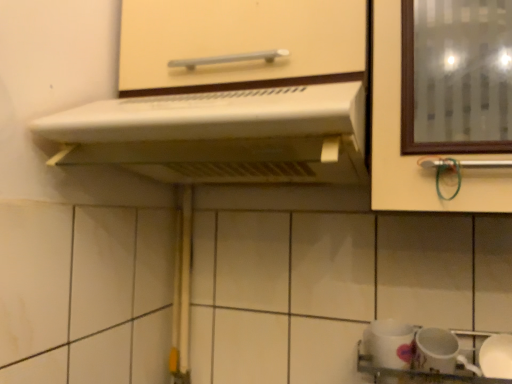
Image resolution: width=512 pixels, height=384 pixels. Describe the element at coordinates (496, 356) in the screenshot. I see `white glossy mug at lower right, the first tableware in the right-to-left sequence` at that location.

Identify the location of matte white cabinet handle at upper center. The image size is (512, 384). (240, 44).

Where is `white glossy mug at lower right, which appears as the second tableware when viewed from the right`? This screenshot has height=384, width=512. white glossy mug at lower right, which appears as the second tableware when viewed from the right is located at coordinates (389, 344).

Where is `white plastic range hood at upper center`? The width and height of the screenshot is (512, 384). white plastic range hood at upper center is located at coordinates (221, 135).

You are a GUI agent. You are given a task and a screenshot of the screen. Output one action in this format:
    pyautogui.click(x=<x>, y=<y>)
    Task: Click on the white glossy mug at lower right, the first tableware in the right-to-left sequence
    The height and width of the screenshot is (384, 512).
    Given the screenshot: What is the action you would take?
    pyautogui.click(x=496, y=356)

Does matte white cabinet handle at upper center come behind white plastic range hood at upper center?

That is True.

Is point (138, 46) less distant than point (110, 129)?

No, it is not.

Which is more to the left, matte white cabinet handle at upper center or white plastic range hood at upper center?

Positioned to the left is white plastic range hood at upper center.

From a real-world perspective, between matte white cabinet handle at upper center and white plastic range hood at upper center, who is vertically higher?

matte white cabinet handle at upper center is physically above.

Between white plastic range hood at upper center and white glossy mug at lower right, which appears as the second tableware when viewed from the right, which one has less height?

Standing shorter between the two is white glossy mug at lower right, which appears as the second tableware when viewed from the right.

How far apart are white plastic range hood at upper center and white glossy mug at lower right, which appears as the second tableware when viewed from the right?

white plastic range hood at upper center is 20.06 inches from white glossy mug at lower right, which appears as the second tableware when viewed from the right.

Between white plastic range hood at upper center and white glossy mug at lower right, placed as the first tableware when sorted from left to right, which one has smaller size?

With smaller size is white glossy mug at lower right, placed as the first tableware when sorted from left to right.

Considering the points (510, 372) and (486, 334), which point is in front, point (510, 372) or point (486, 334)?

The point (510, 372) is closer to the camera.

In terms of width, does white glossy mug at lower right, the first tableware in the right-to-left sequence, look wider or thinner when compared to white glossy sink at lower right?

Considering their sizes, white glossy mug at lower right, the first tableware in the right-to-left sequence, looks slimmer than white glossy sink at lower right.

You are a GUI agent. You are given a task and a screenshot of the screen. Output one action in this format:
    pyautogui.click(x=<x>, y=<y>)
    Task: Click on the sink in front of the white glossy mug at lower right, arranged as the second tableware when viewed from the left
    The image size is (512, 384).
    Given the screenshot: What is the action you would take?
    pyautogui.click(x=418, y=373)

Is the surface of white glossy mug at lower right, the first tableware in the right-to-left sequence, in direct contact with white glossy sink at lower right?

Yes, white glossy mug at lower right, the first tableware in the right-to-left sequence, is touching white glossy sink at lower right.

From a real-world perspective, is matte white cabinet handle at upper center under white glossy sink at lower right?

No, from a real-world perspective, matte white cabinet handle at upper center is not below white glossy sink at lower right.

Can you confirm if matte white cabinet handle at upper center is thinner than white glossy sink at lower right?

Incorrect, the width of matte white cabinet handle at upper center is not less than that of white glossy sink at lower right.

Is point (186, 18) closer or farther from the camera than point (367, 366)?

Point (186, 18) appears to be closer to the viewer than point (367, 366).

Can you confirm if matte white cabinet handle at upper center is smaller than white glossy mug at lower right, placed as the first tableware when sorted from left to right?

Incorrect, matte white cabinet handle at upper center is not smaller in size than white glossy mug at lower right, placed as the first tableware when sorted from left to right.

How different are the orientations of matte white cabinet handle at upper center and white glossy mug at lower right, placed as the first tableware when sorted from left to right, in degrees?

The angle between the facing direction of matte white cabinet handle at upper center and the facing direction of white glossy mug at lower right, placed as the first tableware when sorted from left to right, is 3.58 degrees.

From the image's perspective, does matte white cabinet handle at upper center appear lower than white glossy mug at lower right, placed as the first tableware when sorted from left to right?

No, from the image's perspective, matte white cabinet handle at upper center is not beneath white glossy mug at lower right, placed as the first tableware when sorted from left to right.

Is matte white cabinet handle at upper center outside of white glossy mug at lower right, which appears as the second tableware when viewed from the right?

Yes.

Is white glossy mug at lower right, arranged as the second tableware when viewed from the left, facing away from white plastic range hood at upper center?

white glossy mug at lower right, arranged as the second tableware when viewed from the left, does not have its back to white plastic range hood at upper center.

Consider the image. Is white glossy mug at lower right, arranged as the second tableware when viewed from the left, to the left or to the right of white plastic range hood at upper center in the image?

Based on their positions, white glossy mug at lower right, arranged as the second tableware when viewed from the left, is located to the right of white plastic range hood at upper center.

The width and height of the screenshot is (512, 384). In order to click on tableware that is the 2nd object to the right of the white plastic range hood at upper center, starting at the anchor in this screenshot , I will do `click(496, 356)`.

Considering the relative sizes of white glossy mug at lower right, the first tableware in the right-to-left sequence, and white plastic range hood at upper center in the image provided, is white glossy mug at lower right, the first tableware in the right-to-left sequence, thinner than white plastic range hood at upper center?

Indeed, white glossy mug at lower right, the first tableware in the right-to-left sequence, has a lesser width compared to white plastic range hood at upper center.

Consider the image. Is white plastic range hood at upper center not near white glossy mug at lower right, arranged as the second tableware when viewed from the left?

No, white plastic range hood at upper center is in close proximity to white glossy mug at lower right, arranged as the second tableware when viewed from the left.

How different are the orientations of white plastic range hood at upper center and white glossy mug at lower right, the first tableware in the right-to-left sequence, in degrees?

2.76 degrees.

Between point (183, 99) and point (485, 365), which one is positioned behind?

The point (485, 365) is behind.

There is a white plastic range hood at upper center. What are the coordinates of `cabinetry above it (from a real-world perspective)` in the screenshot? It's located at (240, 44).

In order to click on the 1st tableware below the white plastic range hood at upper center (from the image's perspective) in this screenshot , I will do `click(389, 344)`.

Based on their spatial positions, is white glossy mug at lower right, the first tableware in the right-to-left sequence, or white glossy mug at lower right, placed as the first tableware when sorted from left to right, further from matte white cabinet handle at upper center?

Based on the image, white glossy mug at lower right, the first tableware in the right-to-left sequence, appears to be further to matte white cabinet handle at upper center.

Considering their positions, is matte white cabinet handle at upper center positioned closer to white plastic range hood at upper center than white glossy mug at lower right, which appears as the second tableware when viewed from the right?

matte white cabinet handle at upper center is closer to white plastic range hood at upper center.

Which object lies nearer to the anchor point white plastic range hood at upper center, white glossy mug at lower right, placed as the first tableware when sorted from left to right, or white glossy mug at lower right, the first tableware in the right-to-left sequence?

Based on the image, white glossy mug at lower right, placed as the first tableware when sorted from left to right, appears to be nearer to white plastic range hood at upper center.

Based on their spatial positions, is white glossy mug at lower right, the first tableware in the right-to-left sequence, or white glossy mug at lower right, which appears as the second tableware when viewed from the right, further from white plastic range hood at upper center?

white glossy mug at lower right, the first tableware in the right-to-left sequence, is further to white plastic range hood at upper center.

Which object lies nearer to the anchor point matte white cabinet handle at upper center, white plastic range hood at upper center or white glossy mug at lower right, arranged as the second tableware when viewed from the left?

white plastic range hood at upper center.

Estimate the real-world distances between objects in this image. Which object is further from white glossy sink at lower right, white glossy mug at lower right, which appears as the second tableware when viewed from the right, or matte white cabinet handle at upper center?

matte white cabinet handle at upper center.

Which object lies further to the anchor point white plastic range hood at upper center, white glossy mug at lower right, placed as the first tableware when sorted from left to right, or white glossy sink at lower right?

white glossy sink at lower right is further to white plastic range hood at upper center.

Based on their spatial positions, is matte white cabinet handle at upper center or white glossy mug at lower right, arranged as the second tableware when viewed from the left, closer to white plastic range hood at upper center?

Among the two, matte white cabinet handle at upper center is located nearer to white plastic range hood at upper center.

Where is `sink between white glossy mug at lower right, which appears as the second tableware when viewed from the right, and white glossy mug at lower right, arranged as the second tableware when viewed from the left, in the horizontal direction`? sink between white glossy mug at lower right, which appears as the second tableware when viewed from the right, and white glossy mug at lower right, arranged as the second tableware when viewed from the left, in the horizontal direction is located at coordinates (418, 373).

At what (x,y) coordinates should I click in order to perform the action: click on home appliance between matte white cabinet handle at upper center and white glossy sink at lower right vertically. Please return your answer as a coordinate pair (x, y). Looking at the image, I should click on (221, 135).

This screenshot has width=512, height=384. I want to click on tableware between matte white cabinet handle at upper center and white glossy mug at lower right, the first tableware in the right-to-left sequence, from top to bottom, so click(x=389, y=344).

Locate an element on the screen. Image resolution: width=512 pixels, height=384 pixels. sink situated between white plastic range hood at upper center and white glossy mug at lower right, the first tableware in the right-to-left sequence, from left to right is located at coordinates (418, 373).